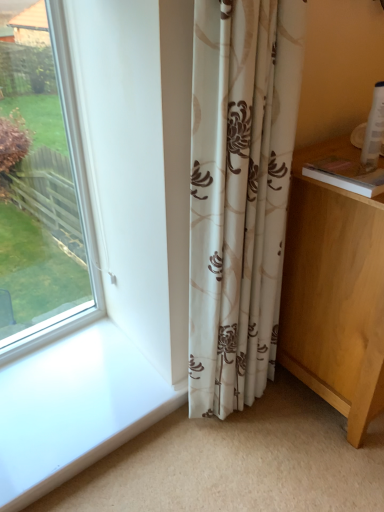
In order to face light wood vanity at lower right, should I rotate leftwards or rightwards?

You should look right and rotate roughly 26.085 degrees.

The image size is (384, 512). What are the coordinates of `light wood vanity at lower right` in the screenshot? It's located at (334, 291).

What do you see at coordinates (334, 291) in the screenshot?
I see `light wood vanity at lower right` at bounding box center [334, 291].

Describe the element at coordinates (239, 192) in the screenshot. I see `beige floral curtain at center` at that location.

Where is `beige floral curtain at center`? beige floral curtain at center is located at coordinates (239, 192).

You are a GUI agent. You are given a task and a screenshot of the screen. Output one action in this format:
    pyautogui.click(x=<x>, y=<y>)
    Task: Click on the light wood vanity at lower right
    
    Given the screenshot: What is the action you would take?
    pyautogui.click(x=334, y=291)

Which object is positioned more to the left, beige floral curtain at center or light wood vanity at lower right?

Positioned to the left is beige floral curtain at center.

Is beige floral curtain at center positioned behind light wood vanity at lower right?

No, the depth of beige floral curtain at center is less than that of light wood vanity at lower right.

Which is behind, point (221, 134) or point (353, 444)?

Positioned behind is point (353, 444).

From the image's perspective, which is below, beige floral curtain at center or light wood vanity at lower right?

light wood vanity at lower right is shown below in the image.

Looking at this image, from a real-world perspective, who is located higher, beige floral curtain at center or light wood vanity at lower right?

beige floral curtain at center is physically above.

Looking at their sizes, would you say beige floral curtain at center is wider or thinner than light wood vanity at lower right?

beige floral curtain at center is thinner than light wood vanity at lower right.

Between beige floral curtain at center and light wood vanity at lower right, which one has less height?

Standing shorter between the two is light wood vanity at lower right.

Considering the relative sizes of beige floral curtain at center and light wood vanity at lower right in the image provided, is beige floral curtain at center bigger than light wood vanity at lower right?

No, beige floral curtain at center is not bigger than light wood vanity at lower right.

Is beige floral curtain at center not within light wood vanity at lower right?

Indeed, beige floral curtain at center is completely outside light wood vanity at lower right.

Would you say beige floral curtain at center is a long distance from light wood vanity at lower right?

Actually, beige floral curtain at center and light wood vanity at lower right are a little close together.

Is beige floral curtain at center turned away from light wood vanity at lower right?

No.

Can you tell me how much beige floral curtain at center and light wood vanity at lower right differ in facing direction?

1.02 degrees.

Looking at this image, measure the distance between beige floral curtain at center and light wood vanity at lower right.

beige floral curtain at center and light wood vanity at lower right are 9.10 inches apart.

You are a GUI agent. You are given a task and a screenshot of the screen. Output one action in this format:
    pyautogui.click(x=<x>, y=<y>)
    Task: Click on the curtain on the left side of light wood vanity at lower right
    
    Given the screenshot: What is the action you would take?
    pyautogui.click(x=239, y=192)

Based on their positions, is light wood vanity at lower right located to the left or right of beige floral curtain at center?

light wood vanity at lower right is to the right of beige floral curtain at center.

Between light wood vanity at lower right and beige floral curtain at center, which one is positioned behind?

light wood vanity at lower right is further from the camera.

Between point (331, 241) and point (258, 229), which one is positioned behind?

The point (331, 241) is more distant.

From the image's perspective, is light wood vanity at lower right beneath beige floral curtain at center?

Correct, light wood vanity at lower right appears lower than beige floral curtain at center in the image.

From a real-world perspective, between light wood vanity at lower right and beige floral curtain at center, who is vertically lower?

In real-world perspective, light wood vanity at lower right is lower.

Considering the relative sizes of light wood vanity at lower right and beige floral curtain at center in the image provided, is light wood vanity at lower right thinner than beige floral curtain at center?

Incorrect, the width of light wood vanity at lower right is not less than that of beige floral curtain at center.

Considering the relative sizes of light wood vanity at lower right and beige floral curtain at center in the image provided, is light wood vanity at lower right taller than beige floral curtain at center?

No, light wood vanity at lower right is not taller than beige floral curtain at center.

Based on their sizes in the image, would you say light wood vanity at lower right is bigger or smaller than beige floral curtain at center?

Considering their sizes, light wood vanity at lower right takes up more space than beige floral curtain at center.

Choose the correct answer: Is light wood vanity at lower right inside beige floral curtain at center or outside it?

light wood vanity at lower right lies outside beige floral curtain at center.

Is light wood vanity at lower right not close to beige floral curtain at center?

No, light wood vanity at lower right is in close proximity to beige floral curtain at center.

Is light wood vanity at lower right aimed at beige floral curtain at center?

No.

Can you tell me how much light wood vanity at lower right and beige floral curtain at center differ in facing direction?

The angle between the facing direction of light wood vanity at lower right and the facing direction of beige floral curtain at center is 1.02 degrees.

Locate an element on the screen. This screenshot has height=512, width=384. curtain that is above the light wood vanity at lower right (from the image's perspective) is located at coordinates (239, 192).

Identify the location of curtain above the light wood vanity at lower right (from a real-world perspective). The height and width of the screenshot is (512, 384). (239, 192).

Locate an element on the screen. This screenshot has width=384, height=512. vanity located behind the beige floral curtain at center is located at coordinates (334, 291).